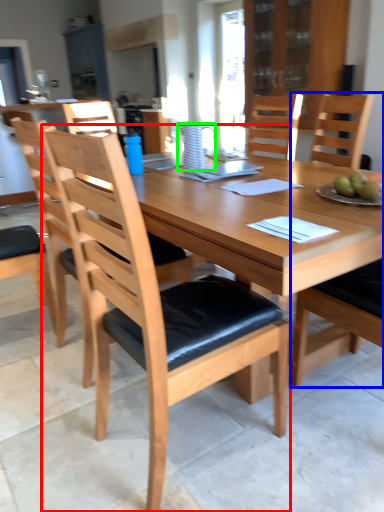
Question: Considering the real-world distances, which object is farthest from chair (highlighted by a red box)? chair (highlighted by a blue box) or pitcher (highlighted by a green box)?

Choices:
 (A) chair
 (B) pitcher

Answer: (A)